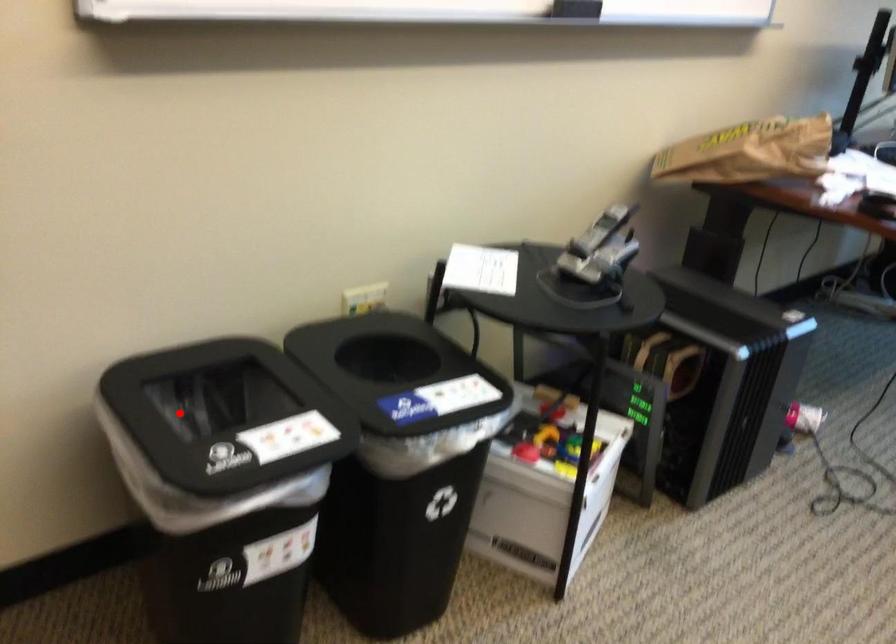
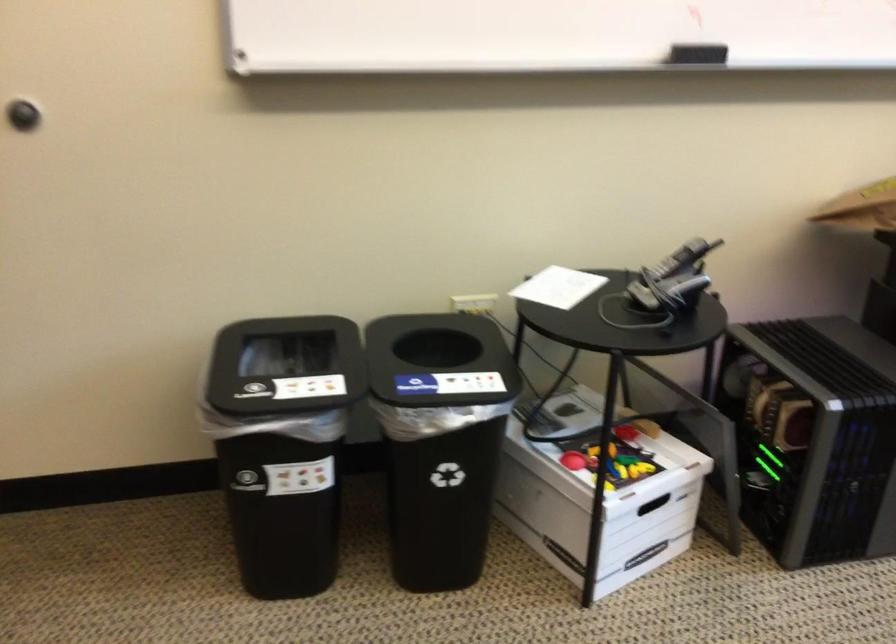
Question: I am providing you with two images of the same scene from different viewpoints. A red point is shown in image1. For the corresponding object point in image2, is it positioned nearer or farther from the camera?

Choices:
 (A) Nearer
 (B) Farther

Answer: (B)